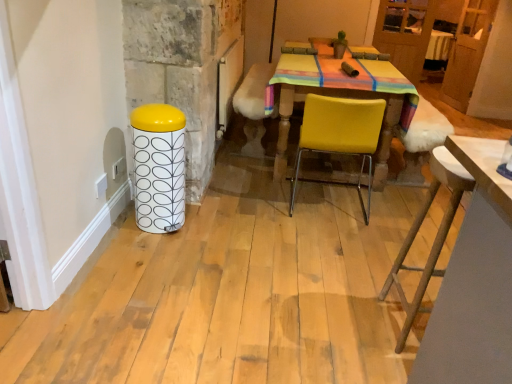
Question: Does point (311, 104) appear closer or farther from the camera than point (152, 137)?

Choices:
 (A) closer
 (B) farther

Answer: (B)

Question: From a real-world perspective, is yellow matte chair at center positioned above or below white glossy trash can at left?

Choices:
 (A) below
 (B) above

Answer: (B)

Question: Considering the real-world distances, which object is farthest from the wooden table at lower right?

Choices:
 (A) yellow matte chair at center
 (B) velvet yellow armchair at center
 (C) white glossy trash can at left

Answer: (B)

Question: Estimate the real-world distances between objects in this image. Which object is closer to the white glossy trash can at left?

Choices:
 (A) wooden table at lower right
 (B) yellow matte chair at center
 (C) velvet yellow armchair at center

Answer: (B)